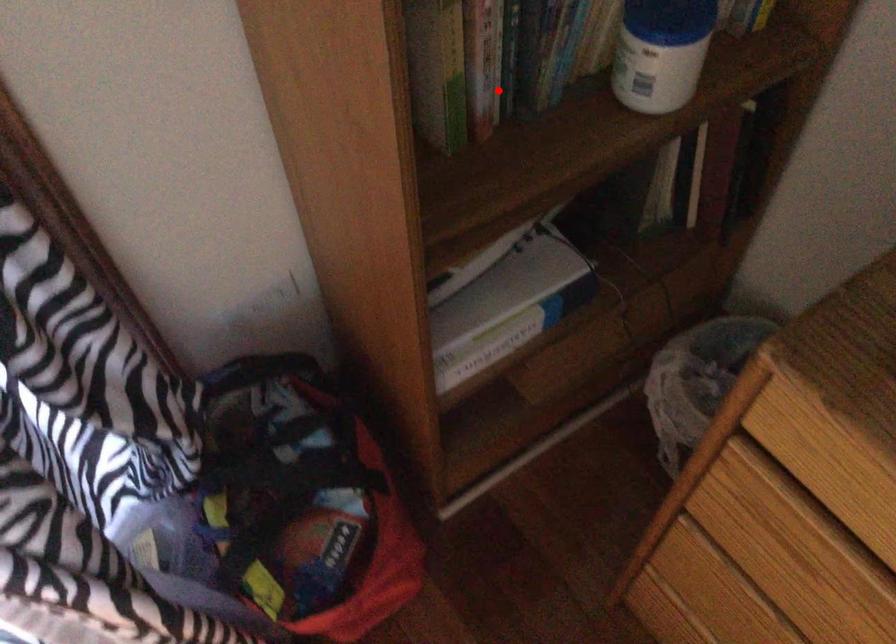
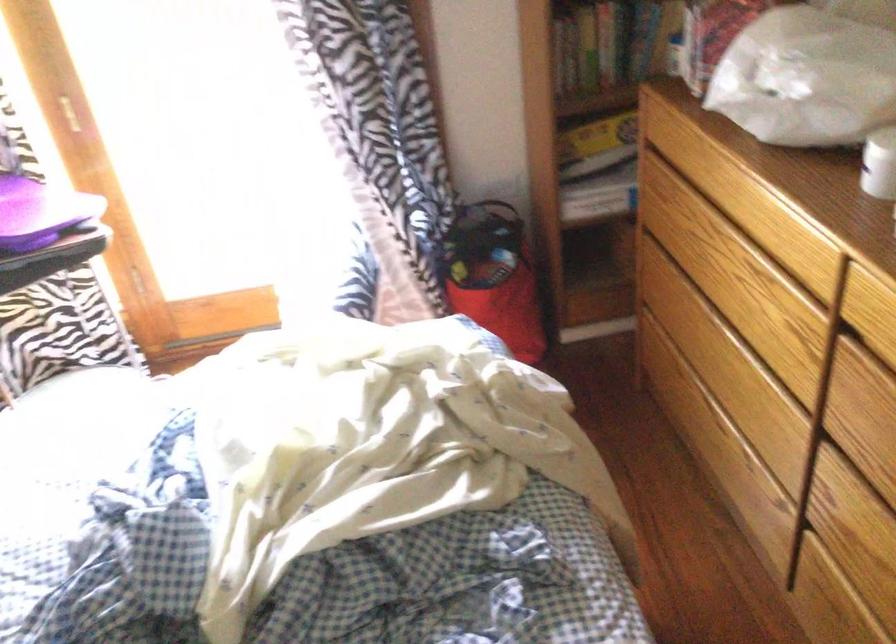
Question: I am providing you with two images of the same scene from different viewpoints. In image1, a red point is highlighted. Considering the same 3D point in image2, which of the following is correct?

Choices:
 (A) It is closer
 (B) It is farther

Answer: (B)